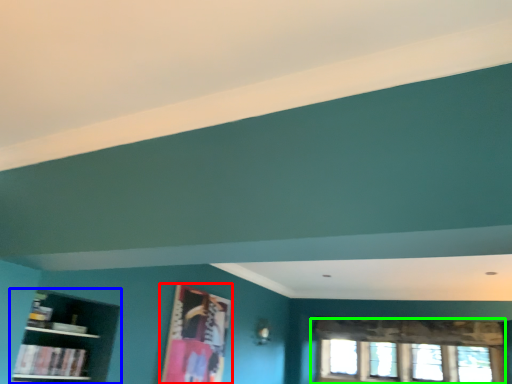
Question: Which object is positioned farthest from picture frame (highlighted by a red box)? Select from shelf (highlighted by a blue box) and window (highlighted by a green box).

Choices:
 (A) shelf
 (B) window

Answer: (B)